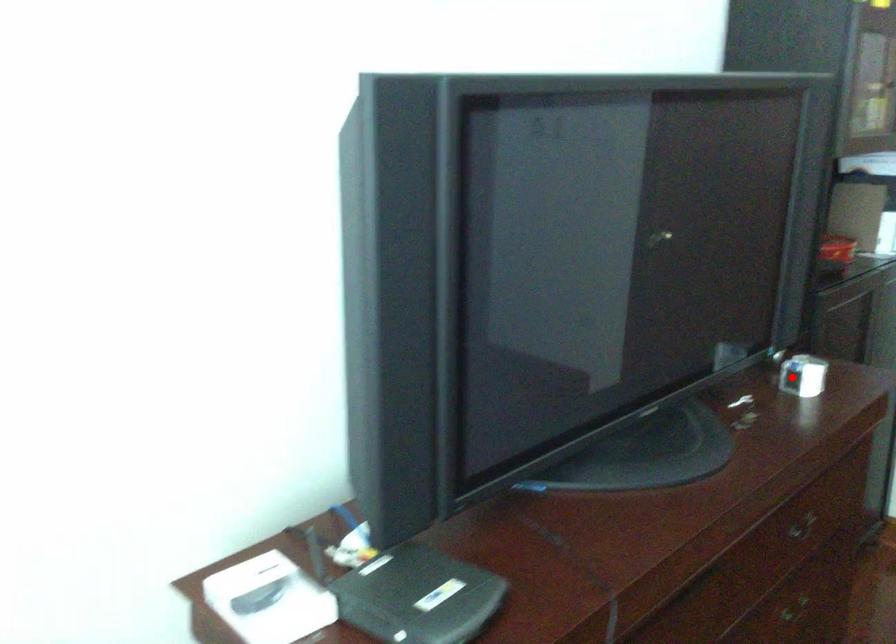
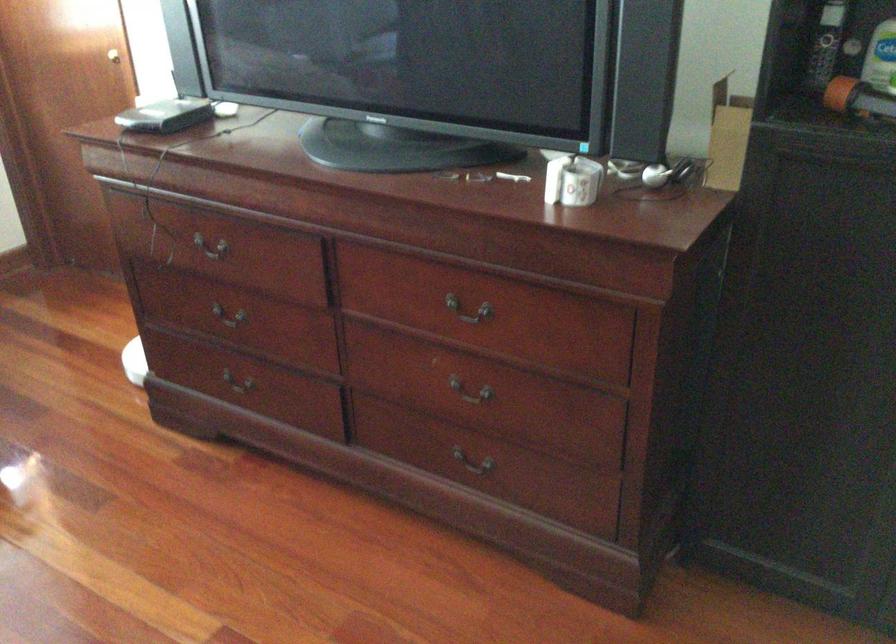
Question: I am providing you with two images of the same scene from different viewpoints. In image1, a red point is highlighted. Considering the same 3D point in image2, which of the following is correct?

Choices:
 (A) It is closer
 (B) It is farther

Answer: (A)